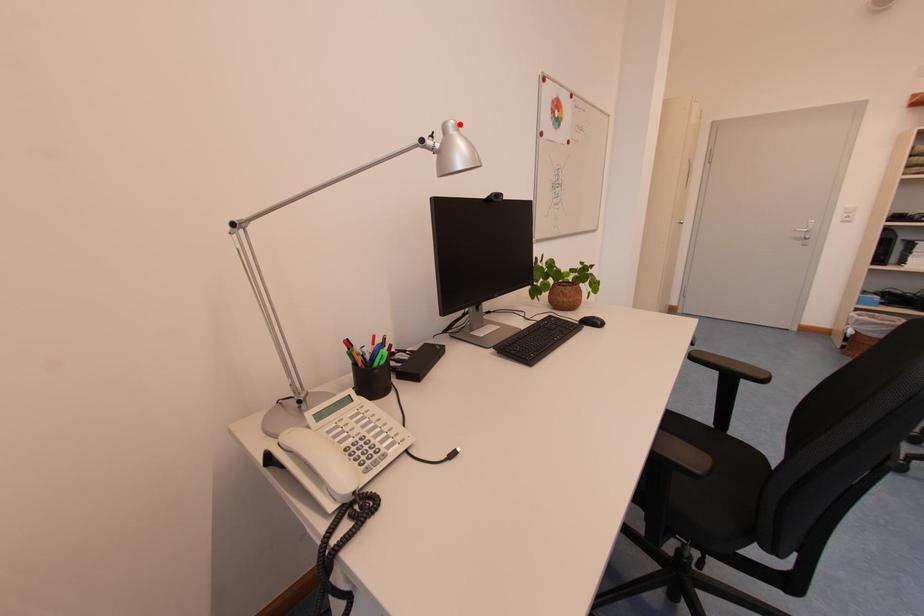
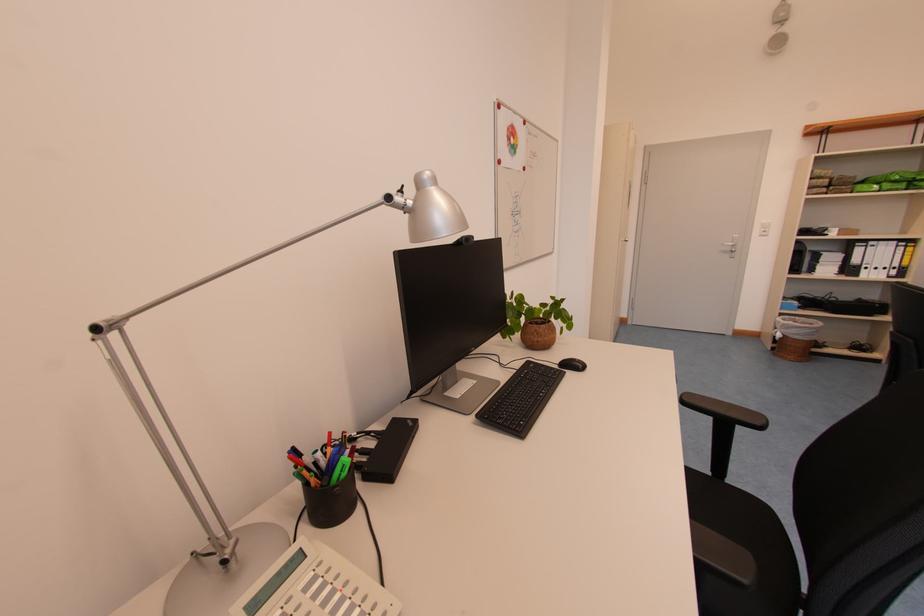
In the second image, find the point that corresponds to the highlighted location in the first image.

(434, 175)